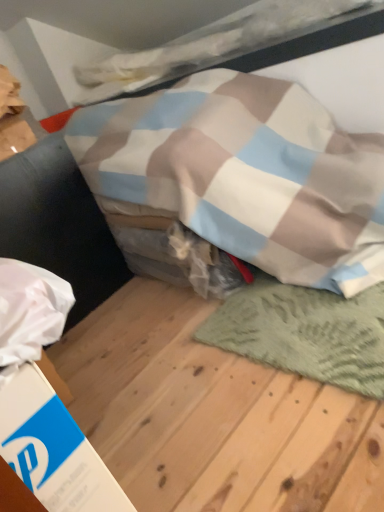
Question: Is green textured rug at lower right next to white cardboard box at lower left?

Choices:
 (A) yes
 (B) no

Answer: (B)

Question: Would you say white cardboard box at lower left is part of green textured rug at lower right's contents?

Choices:
 (A) no
 (B) yes

Answer: (A)

Question: Considering the relative positions of green textured rug at lower right and white cardboard box at lower left in the image provided, is green textured rug at lower right to the left of white cardboard box at lower left from the viewer's perspective?

Choices:
 (A) yes
 (B) no

Answer: (B)

Question: From a real-world perspective, does green textured rug at lower right sit lower than white cardboard box at lower left?

Choices:
 (A) yes
 (B) no

Answer: (A)

Question: Considering the relative positions of green textured rug at lower right and white cardboard box at lower left in the image provided, is green textured rug at lower right to the right of white cardboard box at lower left from the viewer's perspective?

Choices:
 (A) no
 (B) yes

Answer: (B)

Question: Does point [319, 379] appear closer or farther from the camera than point [34, 367]?

Choices:
 (A) closer
 (B) farther

Answer: (B)

Question: From the image's perspective, is green knitted mat at lower right located above or below white cardboard box at lower left?

Choices:
 (A) above
 (B) below

Answer: (A)

Question: From their relative heights in the image, would you say green knitted mat at lower right is taller or shorter than white cardboard box at lower left?

Choices:
 (A) short
 (B) tall

Answer: (A)

Question: In terms of size, does green knitted mat at lower right appear bigger or smaller than white cardboard box at lower left?

Choices:
 (A) big
 (B) small

Answer: (A)

Question: Is green textured rug at lower right in front of or behind green knitted mat at lower right in the image?

Choices:
 (A) front
 (B) behind

Answer: (A)

Question: Is point (104, 440) positioned closer to the camera than point (289, 356)?

Choices:
 (A) closer
 (B) farther

Answer: (A)

Question: From a real-world perspective, is green textured rug at lower right positioned above or below green knitted mat at lower right?

Choices:
 (A) above
 (B) below

Answer: (B)

Question: Would you say green textured rug at lower right is to the left or to the right of green knitted mat at lower right in the picture?

Choices:
 (A) left
 (B) right

Answer: (A)

Question: Is white cardboard box at lower left wider or thinner than green textured rug at lower right?

Choices:
 (A) wide
 (B) thin

Answer: (B)

Question: Considering the positions of white cardboard box at lower left and green textured rug at lower right in the image, is white cardboard box at lower left taller or shorter than green textured rug at lower right?

Choices:
 (A) short
 (B) tall

Answer: (B)